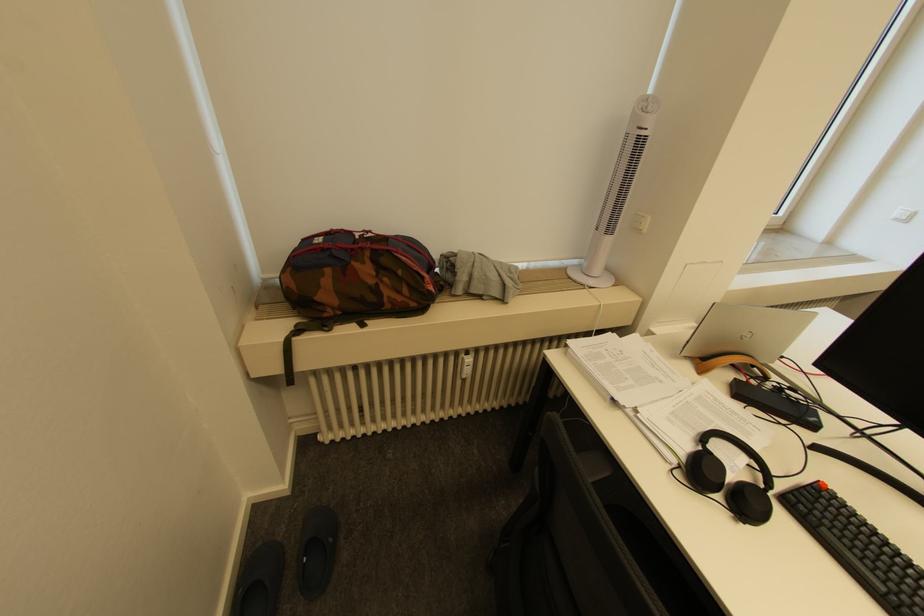
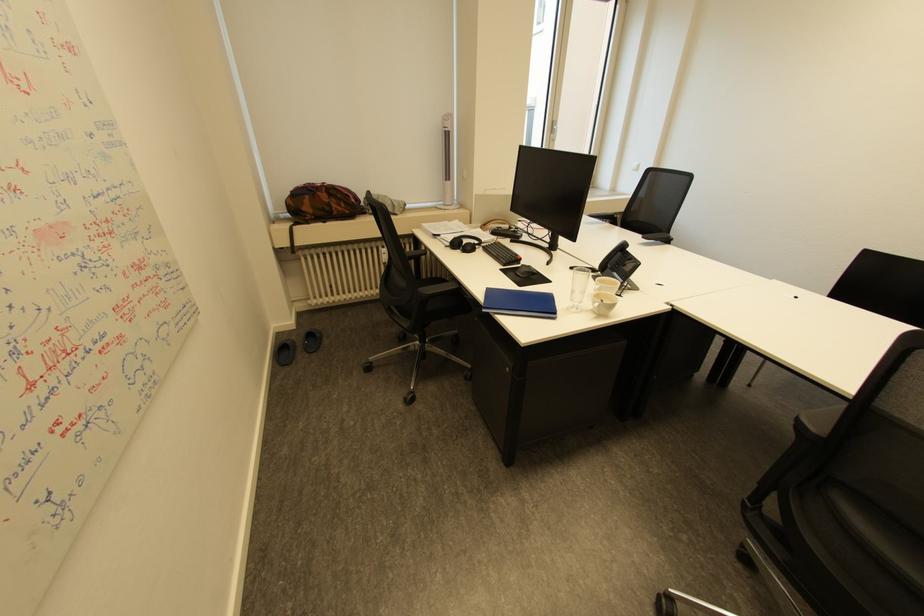
Find the pixel in the second image that matches point (360, 264) in the first image.

(324, 193)